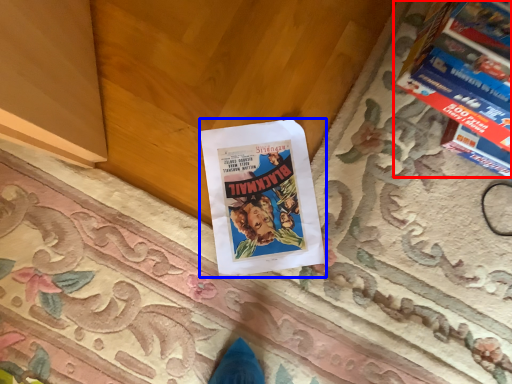
Question: Which point is further to the camera, magazine (highlighted by a red box) or book (highlighted by a blue box)?

Choices:
 (A) magazine
 (B) book

Answer: (B)